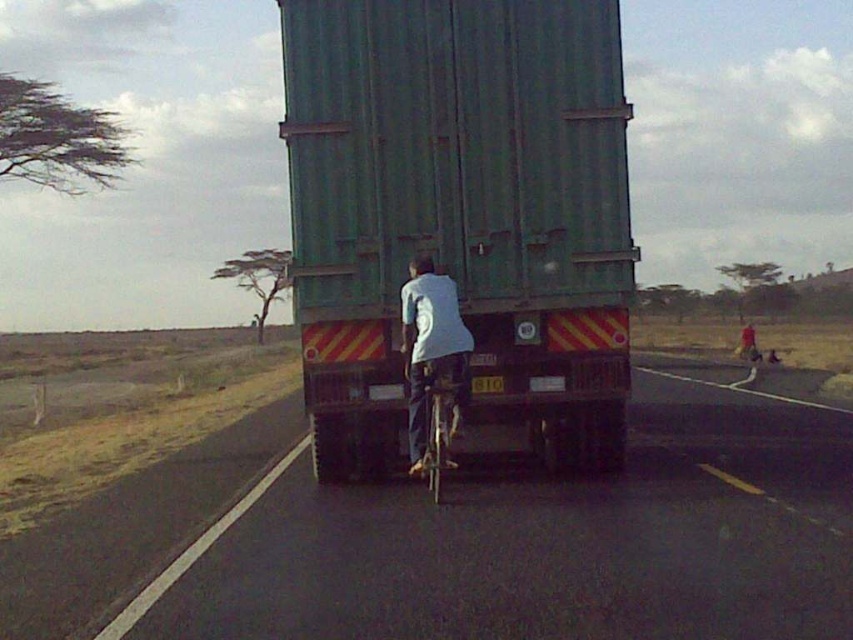
You are driving a car and see the black asphalt road at center and the metallic silver bicycle at center. Which object is nearer to you?

The black asphalt road at center is closer to the viewer than the metallic silver bicycle at center, so the road is nearer.

You are a cyclist trying to navigate the road. The green matte trailer truck at center is blocking your path. Can you safely move to the black asphalt road at center to bypass the truck?

The black asphalt road at center is to the right of the green matte trailer truck at center, so you can safely move to the right side of the road to bypass the truck.

You are a cyclist riding a metallic silver bicycle at center on a black asphalt road at center. You want to know if you can safely ride your bicycle on the road. Can you confirm if the road is suitable for cycling?

The black asphalt road at center is positioned under metallic silver bicycle at center, indicating that the bicycle is on the road. Therefore, the road is suitable for cycling.